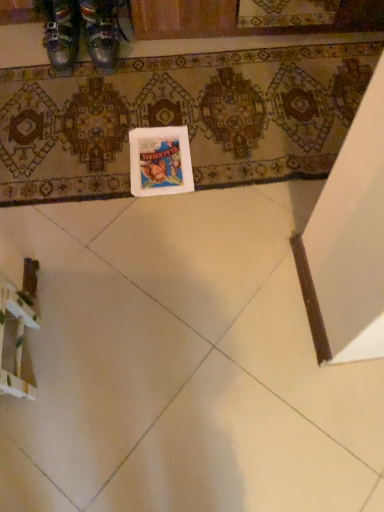
Question: Should I look upward or downward to see white glossy tile at lower left?

Choices:
 (A) up
 (B) down

Answer: (B)

Question: From the image's perspective, is metallic leather shoes at upper left, which ranks as the second footwear in right-to-left order, over metallic leather shoes at upper left, the 1th footwear from the right?

Choices:
 (A) no
 (B) yes

Answer: (A)

Question: Is metallic leather shoes at upper left, which is counted as the first footwear, starting from the left, next to metallic leather shoes at upper left, the 1th footwear from the right, and touching it?

Choices:
 (A) yes
 (B) no

Answer: (A)

Question: Is metallic leather shoes at upper left, which is counted as the first footwear, starting from the left, not inside metallic leather shoes at upper left, arranged as the second footwear when viewed from the left?

Choices:
 (A) no
 (B) yes

Answer: (B)

Question: Can you confirm if metallic leather shoes at upper left, which ranks as the second footwear in right-to-left order, is taller than metallic leather shoes at upper left, arranged as the second footwear when viewed from the left?

Choices:
 (A) yes
 (B) no

Answer: (B)

Question: Does metallic leather shoes at upper left, which ranks as the second footwear in right-to-left order, have a greater width compared to metallic leather shoes at upper left, arranged as the second footwear when viewed from the left?

Choices:
 (A) yes
 (B) no

Answer: (B)

Question: Does metallic leather shoes at upper left, which is counted as the first footwear, starting from the left, have a larger size compared to metallic leather shoes at upper left, the 1th footwear from the right?

Choices:
 (A) no
 (B) yes

Answer: (B)

Question: Does white glossy tile at lower left have a greater width compared to white matte postcard at center?

Choices:
 (A) yes
 (B) no

Answer: (A)

Question: Considering the relative sizes of white glossy tile at lower left and white matte postcard at center in the image provided, is white glossy tile at lower left shorter than white matte postcard at center?

Choices:
 (A) no
 (B) yes

Answer: (A)

Question: Is white glossy tile at lower left smaller than white matte postcard at center?

Choices:
 (A) no
 (B) yes

Answer: (A)

Question: Does white glossy tile at lower left turn towards white matte postcard at center?

Choices:
 (A) no
 (B) yes

Answer: (B)

Question: Considering the relative sizes of white glossy tile at lower left and white matte postcard at center in the image provided, is white glossy tile at lower left thinner than white matte postcard at center?

Choices:
 (A) no
 (B) yes

Answer: (A)

Question: Is white glossy tile at lower left far from white matte postcard at center?

Choices:
 (A) yes
 (B) no

Answer: (B)

Question: Is white glossy tile at lower left beside metallic leather shoes at upper left, which is counted as the first footwear, starting from the left?

Choices:
 (A) no
 (B) yes

Answer: (A)